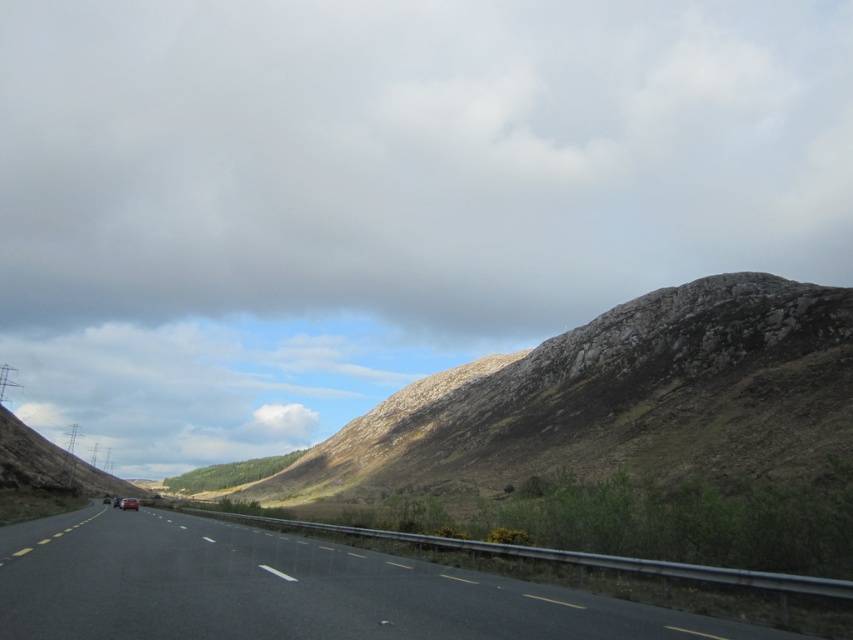
Question: Does cloudy sky at upper center appear under black asphalt highway at center?

Choices:
 (A) no
 (B) yes

Answer: (A)

Question: Does cloudy sky at upper center lie behind black asphalt highway at center?

Choices:
 (A) no
 (B) yes

Answer: (B)

Question: Which of the following is the closest to the observer?

Choices:
 (A) cloudy sky at upper center
 (B) black asphalt highway at center

Answer: (B)

Question: Which point is farther to the camera?

Choices:
 (A) cloudy sky at upper center
 (B) black asphalt highway at center

Answer: (A)

Question: Is the position of cloudy sky at upper center less distant than that of black asphalt highway at center?

Choices:
 (A) yes
 (B) no

Answer: (B)